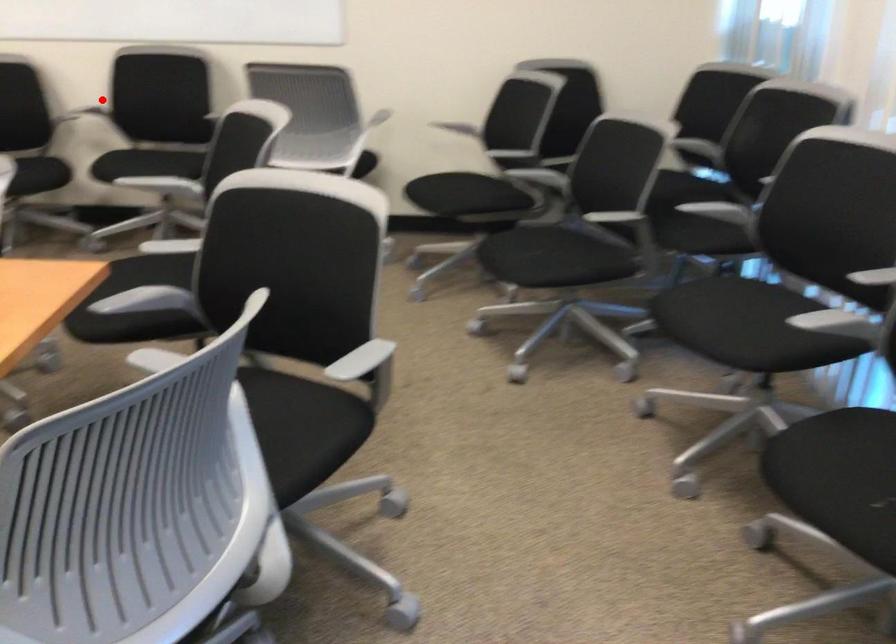
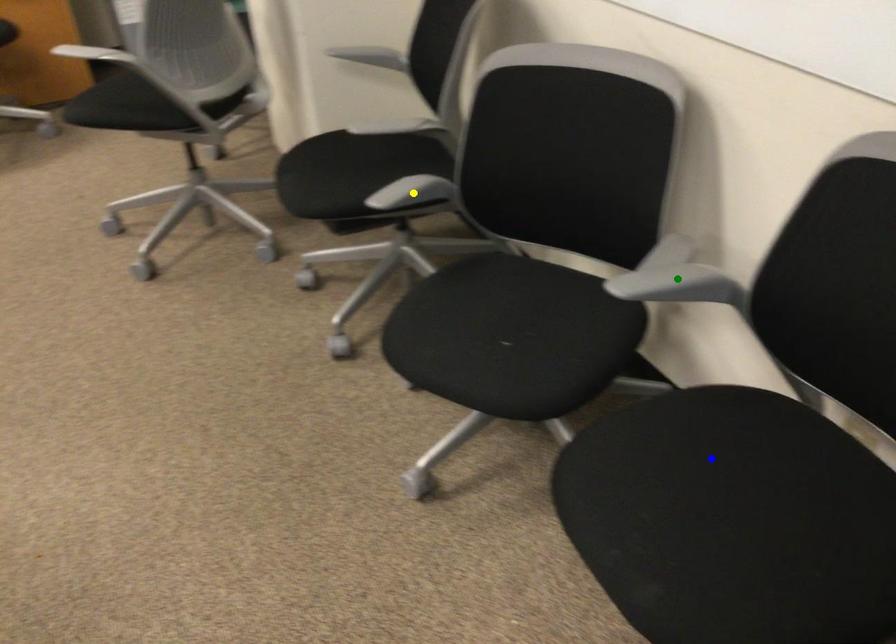
Question: I am providing you with two images of the same scene from different viewpoints. A red point is marked on the first image. You are given multiple points on the second image. Can you choose the point in image 2 that corresponds to the point in image 1?

Choices:
 (A) green point
 (B) yellow point
 (C) blue point

Answer: (A)